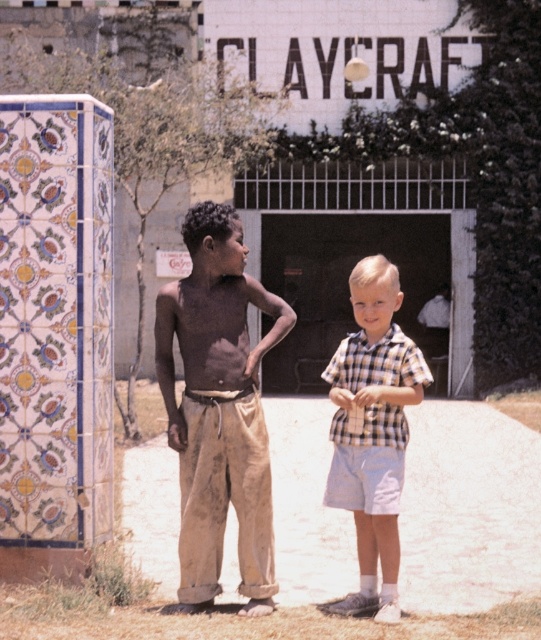
Question: Which of the following is the closest to the observer?

Choices:
 (A) brown cotton pants at center
 (B) checkered fabric shirt at center

Answer: (B)

Question: Which point appears farthest from the camera in this image?

Choices:
 (A) (262, 474)
 (B) (377, 273)

Answer: (A)

Question: Is brown cotton pants at center positioned in front of checkered fabric shirt at center?

Choices:
 (A) yes
 (B) no

Answer: (B)

Question: Where is brown cotton pants at center located in relation to checkered fabric shirt at center in the image?

Choices:
 (A) above
 (B) below

Answer: (B)

Question: Which object appears farthest from the camera in this image?

Choices:
 (A) checkered fabric shirt at center
 (B) brown cotton pants at center

Answer: (B)

Question: Does brown cotton pants at center have a larger size compared to checkered fabric shirt at center?

Choices:
 (A) no
 (B) yes

Answer: (B)